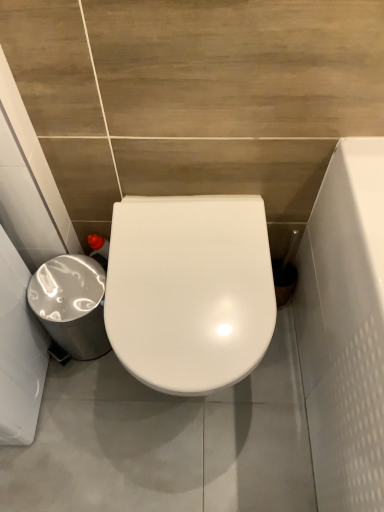
Question: Considering the relative sizes of white glossy toilet at center and silver metallic trash can at lower left in the image provided, is white glossy toilet at center smaller than silver metallic trash can at lower left?

Choices:
 (A) yes
 (B) no

Answer: (B)

Question: Is white glossy toilet at center thinner than silver metallic trash can at lower left?

Choices:
 (A) yes
 (B) no

Answer: (B)

Question: Considering the relative sizes of white glossy toilet at center and silver metallic trash can at lower left in the image provided, is white glossy toilet at center taller than silver metallic trash can at lower left?

Choices:
 (A) no
 (B) yes

Answer: (B)

Question: Could you tell me if white glossy toilet at center is turned towards silver metallic trash can at lower left?

Choices:
 (A) no
 (B) yes

Answer: (A)

Question: Is white glossy toilet at center completely or partially outside of silver metallic trash can at lower left?

Choices:
 (A) no
 (B) yes

Answer: (B)

Question: From the image's perspective, would you say white glossy toilet at center is positioned over silver metallic trash can at lower left?

Choices:
 (A) no
 (B) yes

Answer: (A)

Question: Could you tell me if silver metallic trash can at lower left is facing white glossy toilet at center?

Choices:
 (A) no
 (B) yes

Answer: (A)

Question: Is silver metallic trash can at lower left wider than white glossy toilet at center?

Choices:
 (A) no
 (B) yes

Answer: (A)

Question: From the image's perspective, would you say silver metallic trash can at lower left is shown under white glossy toilet at center?

Choices:
 (A) no
 (B) yes

Answer: (A)

Question: Considering the relative positions of silver metallic trash can at lower left and white glossy toilet at center in the image provided, is silver metallic trash can at lower left to the right of white glossy toilet at center from the viewer's perspective?

Choices:
 (A) yes
 (B) no

Answer: (B)

Question: Does silver metallic trash can at lower left contain white glossy toilet at center?

Choices:
 (A) no
 (B) yes

Answer: (A)

Question: Is silver metallic trash can at lower left taller than white glossy toilet at center?

Choices:
 (A) yes
 (B) no

Answer: (B)

Question: Do you think white glossy toilet at center is within silver metallic trash can at lower left, or outside of it?

Choices:
 (A) outside
 (B) inside

Answer: (A)